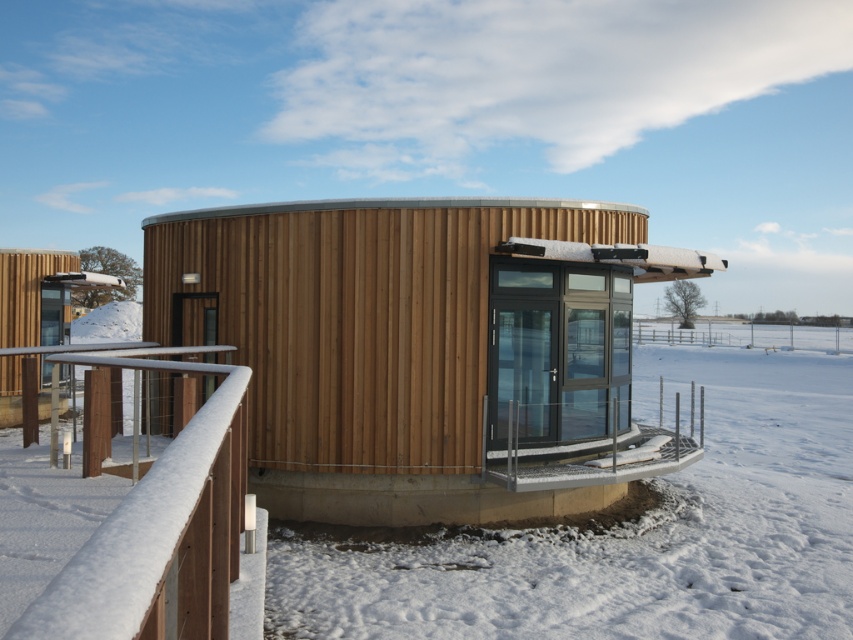
Question: Among these points, which one is farthest from the camera?

Choices:
 (A) (593, 604)
 (B) (236, 369)

Answer: (A)

Question: Which object appears farthest from the camera in this image?

Choices:
 (A) white powdery snow at center
 (B) wooden at left

Answer: (A)

Question: Is white powdery snow at center to the right of wooden at left from the viewer's perspective?

Choices:
 (A) yes
 (B) no

Answer: (A)

Question: Is white powdery snow at center further to camera compared to wooden at left?

Choices:
 (A) yes
 (B) no

Answer: (A)

Question: In this image, where is white powdery snow at center located relative to wooden at left?

Choices:
 (A) left
 (B) right

Answer: (B)